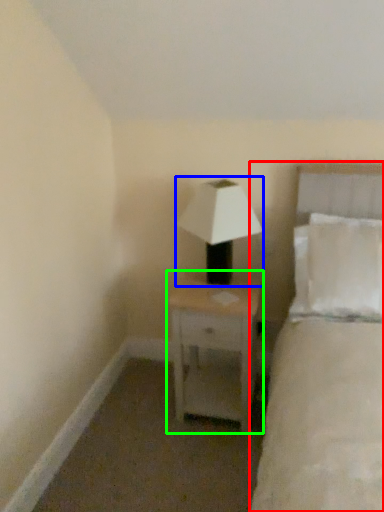
Question: Estimate the real-world distances between objects in this image. Which object is closer to bed (highlighted by a red box), lamp (highlighted by a blue box) or nightstand (highlighted by a green box)?

Choices:
 (A) lamp
 (B) nightstand

Answer: (B)